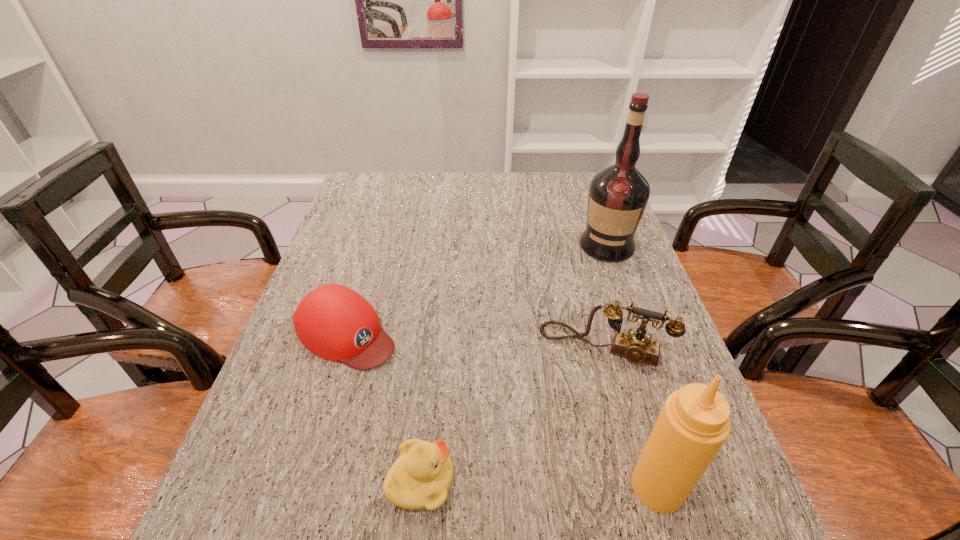
You are a GUI agent. You are given a task and a screenshot of the screen. Output one action in this format:
    pyautogui.click(x=<x>, y=<y>)
    Task: Click on the vacant space positioned on the front-facing side of the third shortest object
    Image resolution: width=960 pixels, height=540 pixels.
    Given the screenshot: What is the action you would take?
    tap(578, 399)

Find the location of a particular element. This screenshot has height=540, width=960. vacant space positioned 0.110m on the surface of the liquor is located at coordinates (593, 286).

Find the location of `vacant region located on the surface of the liquor`. vacant region located on the surface of the liquor is located at coordinates (564, 367).

The height and width of the screenshot is (540, 960). In order to click on vacant point located on the surface of the liquor in this screenshot , I will do `click(576, 335)`.

Locate an element on the screen. free spot located 0.050m on the front-facing side of the leftmost object is located at coordinates (397, 367).

Locate an element on the screen. The image size is (960, 540). free space located 0.190m on the front-facing side of the leftmost object is located at coordinates tap(445, 401).

Where is `vacant space located 0.200m on the front-facing side of the leftmost object`? This screenshot has height=540, width=960. vacant space located 0.200m on the front-facing side of the leftmost object is located at coordinates (449, 403).

Locate an element on the screen. This screenshot has width=960, height=540. duckling that is at the near edge is located at coordinates (421, 476).

You are a GUI agent. You are given a task and a screenshot of the screen. Output one action in this format:
    pyautogui.click(x=<x>, y=<y>)
    Task: Click on the condiment that is at the near edge
    The width and height of the screenshot is (960, 540).
    Given the screenshot: What is the action you would take?
    pyautogui.click(x=694, y=423)

Identify the location of object at the left edge. Image resolution: width=960 pixels, height=540 pixels. (334, 322).